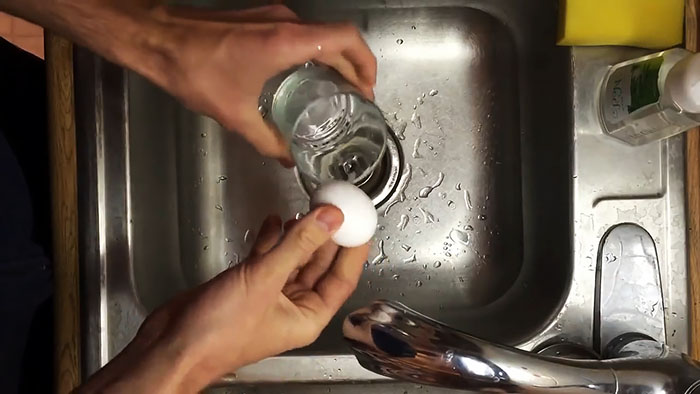
The image size is (700, 394). What are the coordinates of `jar` in the screenshot? It's located at (336, 130).